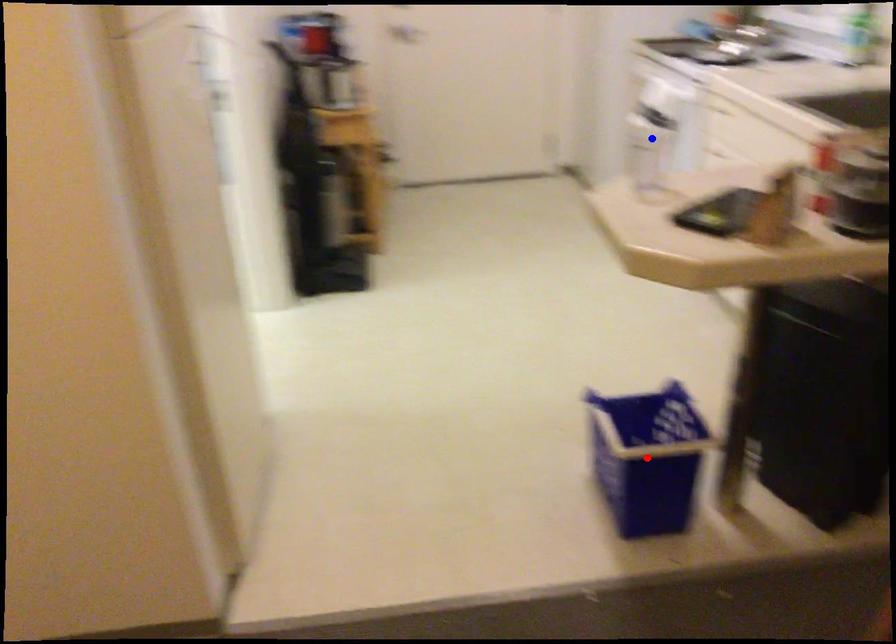
Question: Two points are marked on the image. Which point is closer to the camera?

Choices:
 (A) Blue point is closer.
 (B) Red point is closer.

Answer: (B)